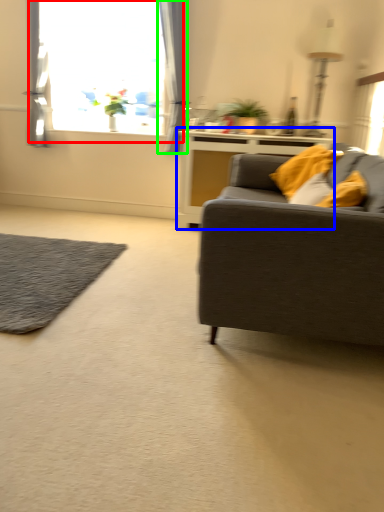
Question: Estimate the real-world distances between objects in this image. Which object is closer to window (highlighted by a red box), table (highlighted by a blue box) or curtain (highlighted by a green box)?

Choices:
 (A) table
 (B) curtain

Answer: (B)